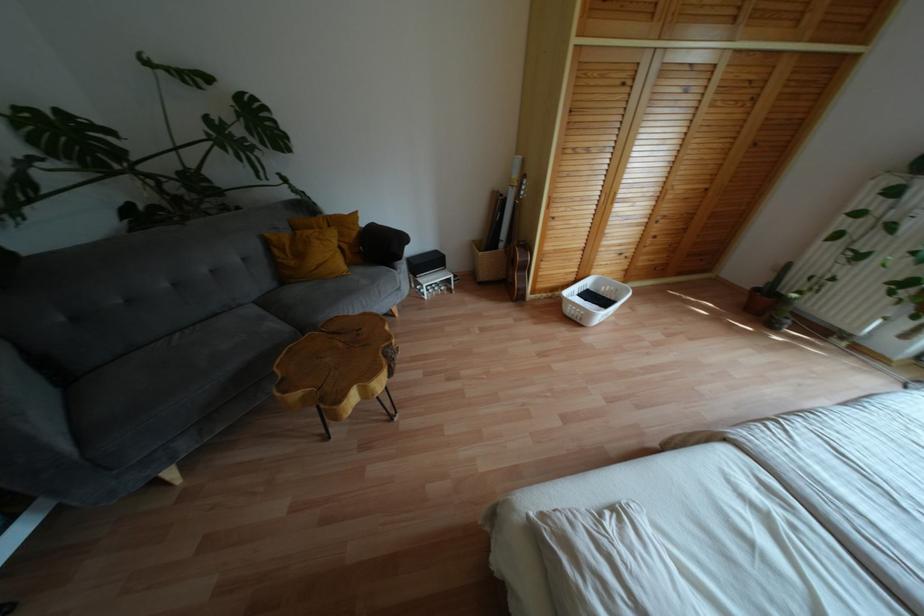
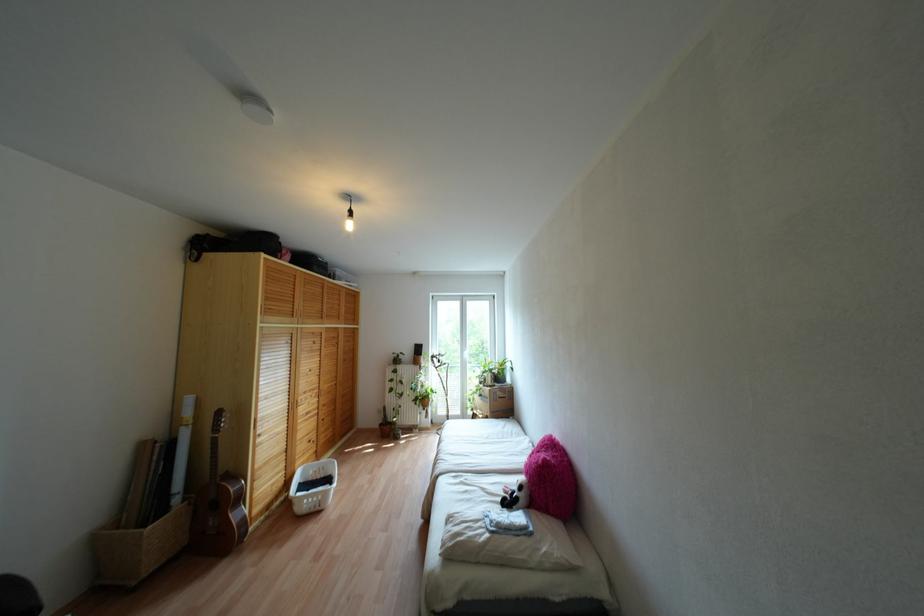
Where in the second image is the point corresponding to the point at 525,267 from the first image?

(238, 498)